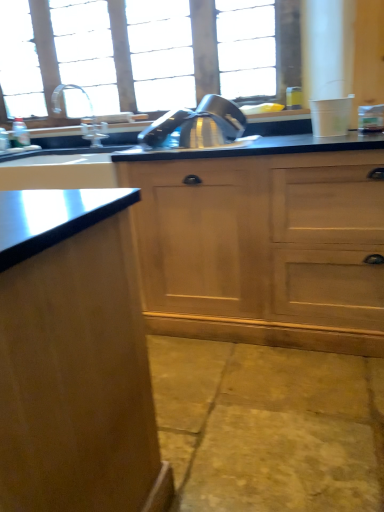
Question: In terms of height, does wooden cabinet at center look taller or shorter compared to yellow stone concrete at lower center?

Choices:
 (A) tall
 (B) short

Answer: (A)

Question: Is point 288,280 closer or farther from the camera than point 304,378?

Choices:
 (A) farther
 (B) closer

Answer: (A)

Question: Estimate the real-world distances between objects in this image. Which object is farther from the yellow stone concrete at lower center?

Choices:
 (A) wooden cabinet at center
 (B) satin nickel faucet at upper left
 (C) clear glass window at upper center

Answer: (C)

Question: Considering the real-world distances, which object is farthest from the yellow stone concrete at lower center?

Choices:
 (A) wooden cabinet at center
 (B) clear glass window at upper center
 (C) satin nickel faucet at upper left

Answer: (B)